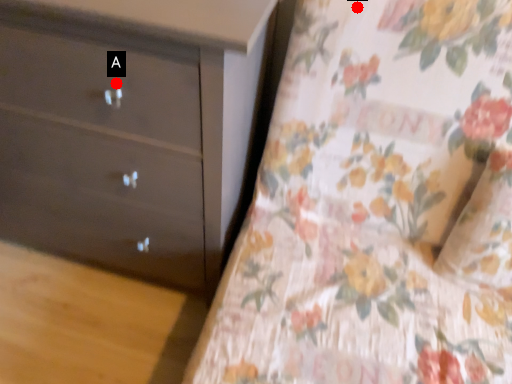
Question: Two points are circled on the image, labeled by A and B beside each circle. Which point is closer to the camera taking this photo?

Choices:
 (A) A is closer
 (B) B is closer

Answer: (A)